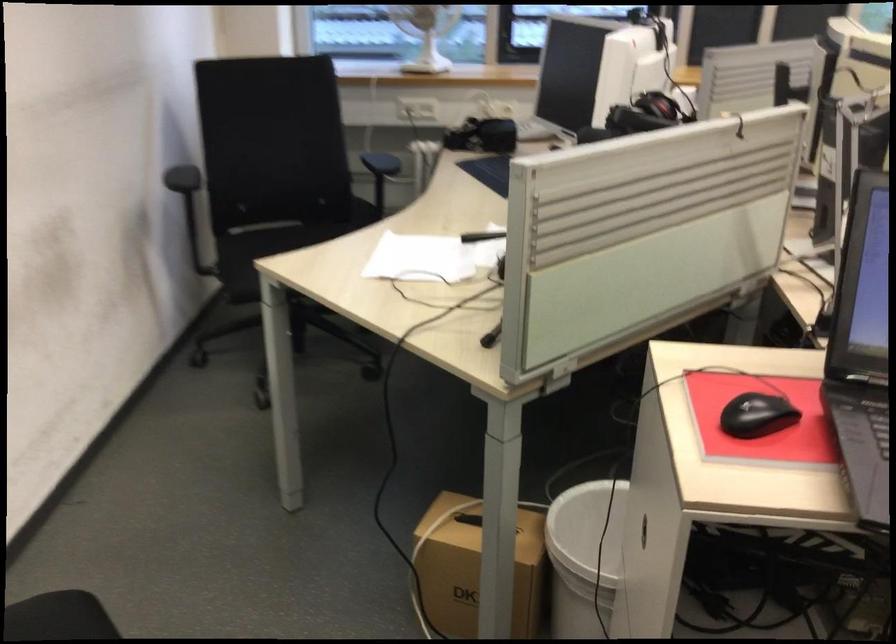
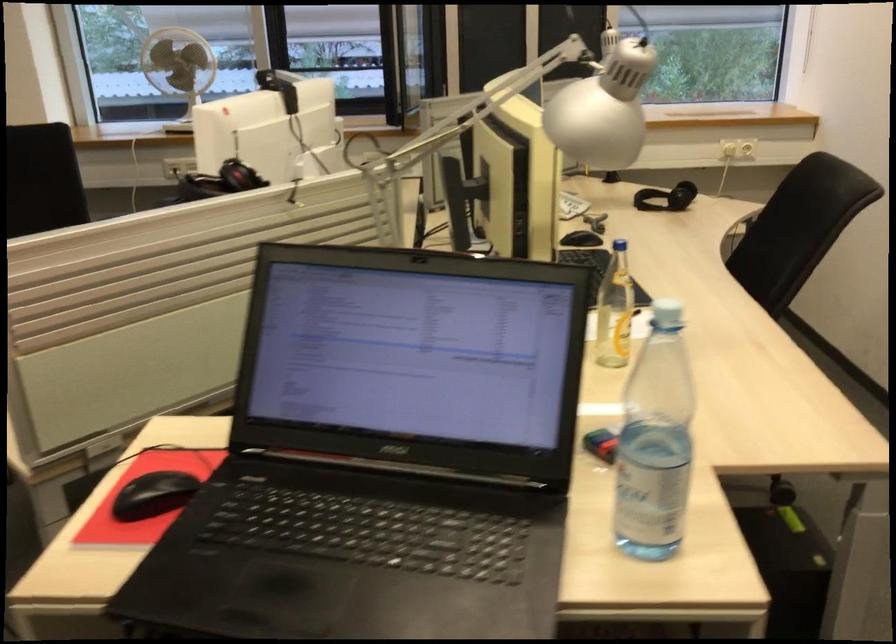
Where in the second image is the point corresponding to the point at 769,413 from the first image?

(153, 495)